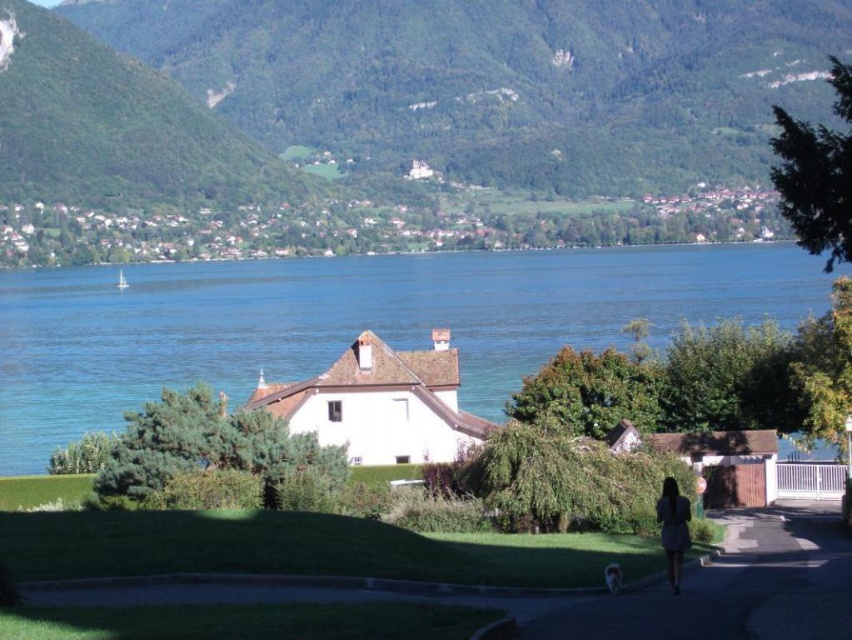
Does point (323, 292) come behind point (750, 525)?

Yes, point (323, 292) is behind point (750, 525).

Can you confirm if blue water at center is positioned to the left of dark green asphalt at lower center?

Indeed, blue water at center is positioned on the left side of dark green asphalt at lower center.

This screenshot has height=640, width=852. What do you see at coordinates (352, 321) in the screenshot?
I see `blue water at center` at bounding box center [352, 321].

At what (x,y) coordinates should I click in order to perform the action: click on blue water at center. Please return your answer as a coordinate pair (x, y). This screenshot has height=640, width=852. Looking at the image, I should click on (352, 321).

Which is above, dark green asphalt at lower center or blue dress at lower right?

blue dress at lower right

Can you confirm if dark green asphalt at lower center is taller than blue dress at lower right?

Yes.

Locate an element on the screen. Image resolution: width=852 pixels, height=640 pixels. dark green asphalt at lower center is located at coordinates (732, 589).

What are the coordinates of `dark green asphalt at lower center` in the screenshot? It's located at (732, 589).

Consider the image. Which of these two, green leafy mountain at upper center or dark green asphalt at lower center, stands taller?

green leafy mountain at upper center

What do you see at coordinates (396, 124) in the screenshot? The width and height of the screenshot is (852, 640). I see `green leafy mountain at upper center` at bounding box center [396, 124].

You are a GUI agent. You are given a task and a screenshot of the screen. Output one action in this format:
    pyautogui.click(x=<x>, y=<y>)
    Task: Click on the green leafy mountain at upper center
    The width and height of the screenshot is (852, 640).
    Given the screenshot: What is the action you would take?
    pyautogui.click(x=396, y=124)